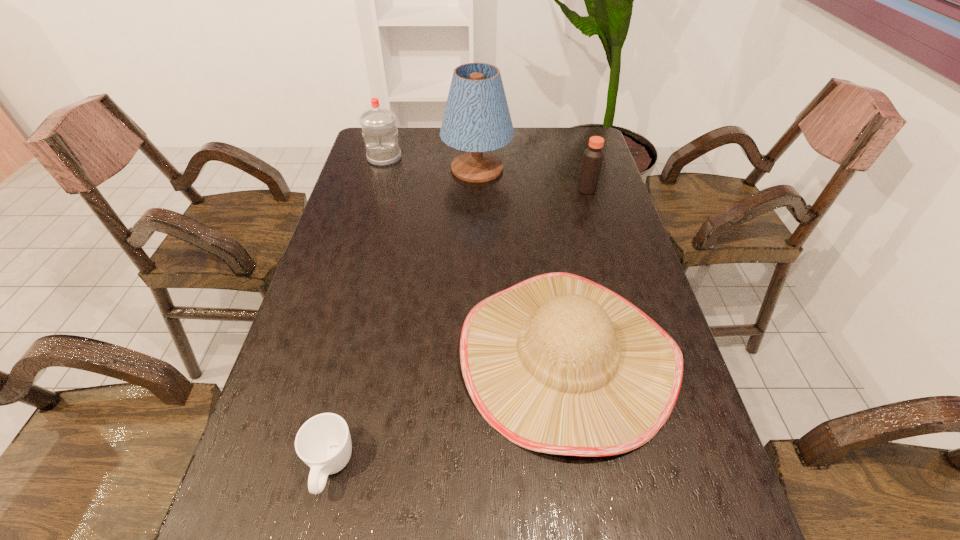
Identify the location of water bottle positioned at the far edge. The image size is (960, 540). pyautogui.click(x=379, y=130).

The height and width of the screenshot is (540, 960). Find the location of `water bottle that is positioned at the left edge`. water bottle that is positioned at the left edge is located at coordinates (379, 130).

The height and width of the screenshot is (540, 960). I want to click on cup that is at the left edge, so click(323, 442).

The height and width of the screenshot is (540, 960). I want to click on vinegar located in the right edge section of the desktop, so click(593, 157).

Locate an element on the screen. sunhat that is at the right edge is located at coordinates (559, 364).

The width and height of the screenshot is (960, 540). In order to click on object situated at the far left corner in this screenshot , I will do pyautogui.click(x=379, y=130).

In order to click on vacant region at the left edge of the desktop in this screenshot , I will do `click(339, 293)`.

In the image, there is a desktop. Identify the location of free space at the right edge. (564, 173).

Where is `blank region between the cup and the vinegar`? This screenshot has height=540, width=960. blank region between the cup and the vinegar is located at coordinates (460, 329).

Where is `empty location between the tallest object and the cup`? empty location between the tallest object and the cup is located at coordinates (404, 319).